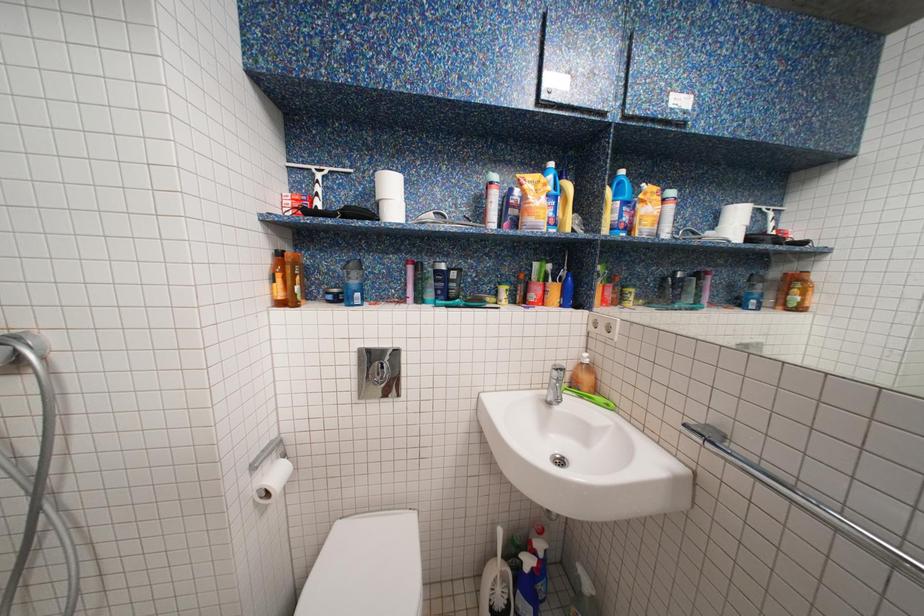
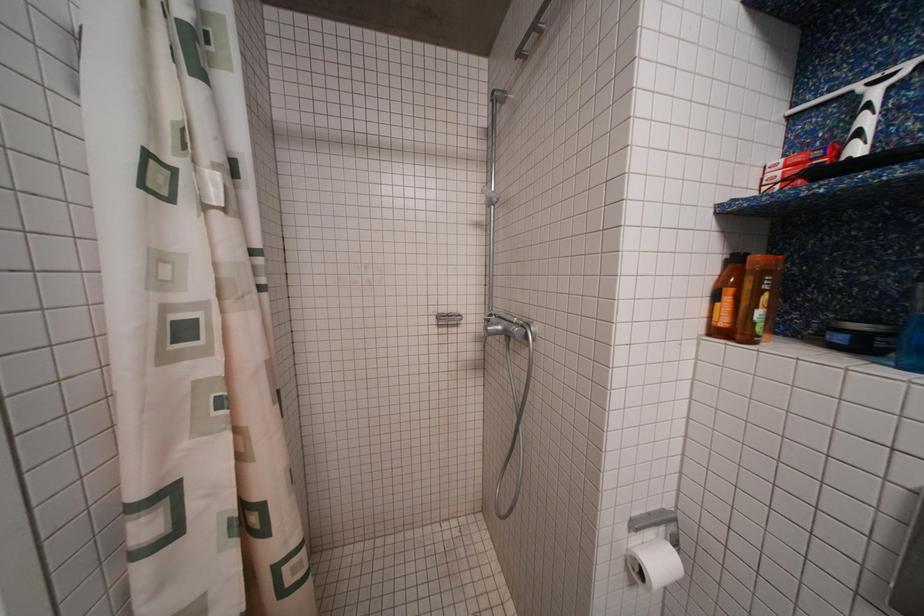
Question: The camera is either moving clockwise (left) or counter-clockwise (right) around the object. The first image is from the beginning of the video and the second image is from the end. Is the camera moving left or right when shooting the video?

Choices:
 (A) Left
 (B) Right

Answer: (B)